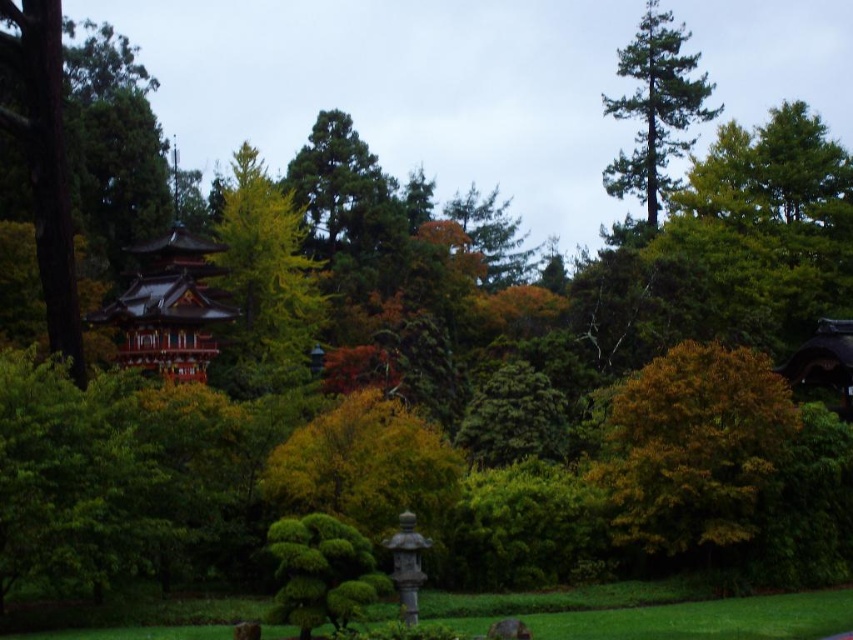
Question: Estimate the real-world distances between objects in this image. Which object is closer to the green textured bush at center?

Choices:
 (A) yellow-green leafy tree at center-left
 (B) green needle-like tree at upper right
 (C) brown rough bark tree at left
 (D) yellow-green foliage at center-right

Answer: (D)

Question: Can you confirm if yellow-green foliage at center-right is smaller than green textured bush at center?

Choices:
 (A) no
 (B) yes

Answer: (A)

Question: Which object is positioned closest to the yellow-green foliage at center-right?

Choices:
 (A) green needle-like tree at upper right
 (B) brown rough bark tree at left
 (C) green textured bush at center

Answer: (C)

Question: Observing the image, what is the correct spatial positioning of shiny red wood temple at center in reference to green needle-like tree at upper right?

Choices:
 (A) below
 (B) above

Answer: (A)

Question: Does yellow-green leafy tree at center-left have a lesser width compared to shiny red wood temple at center?

Choices:
 (A) no
 (B) yes

Answer: (A)

Question: Which point appears farthest from the camera in this image?

Choices:
 (A) (102, 323)
 (B) (25, 84)
 (C) (718, 112)
 (D) (692, 429)

Answer: (C)